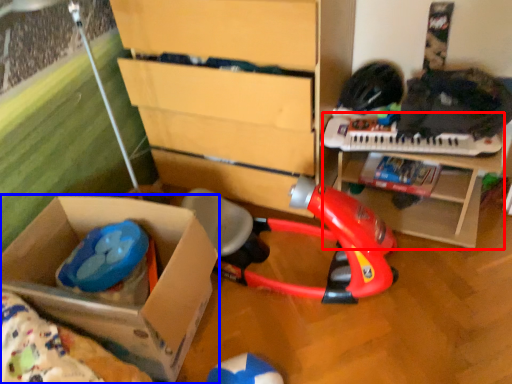
Question: Which object appears closest to the camera in this image, table (highlighted by a red box) or box (highlighted by a blue box)?

Choices:
 (A) table
 (B) box

Answer: (B)